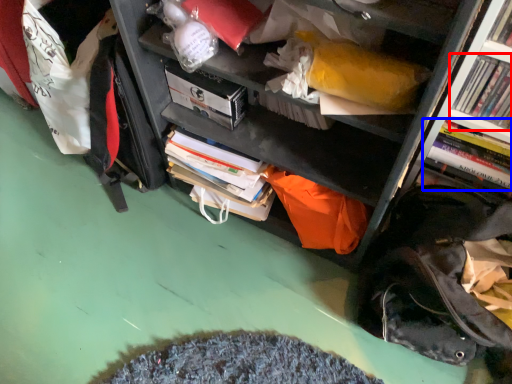
Question: Which point is further to the camera, book (highlighted by a red box) or book (highlighted by a blue box)?

Choices:
 (A) book
 (B) book

Answer: (B)